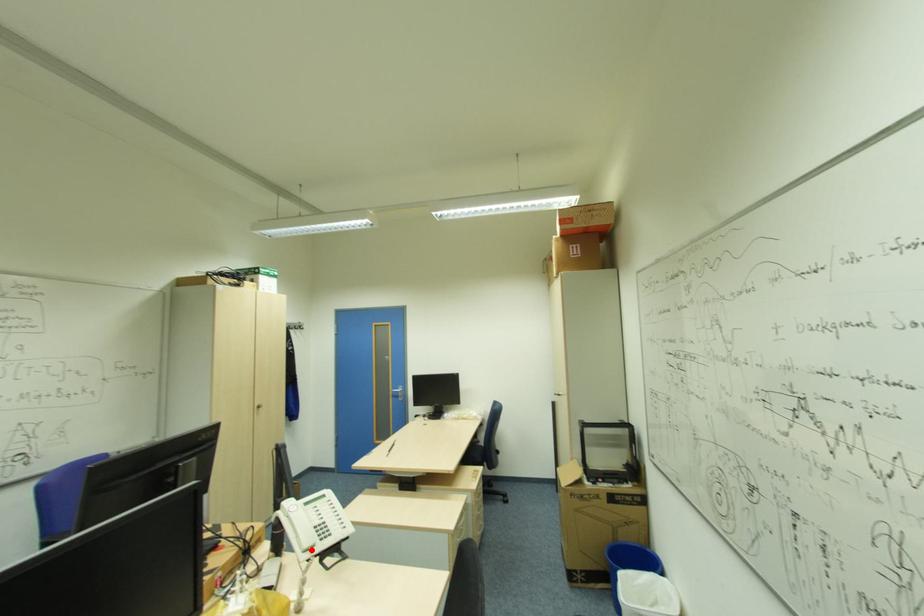
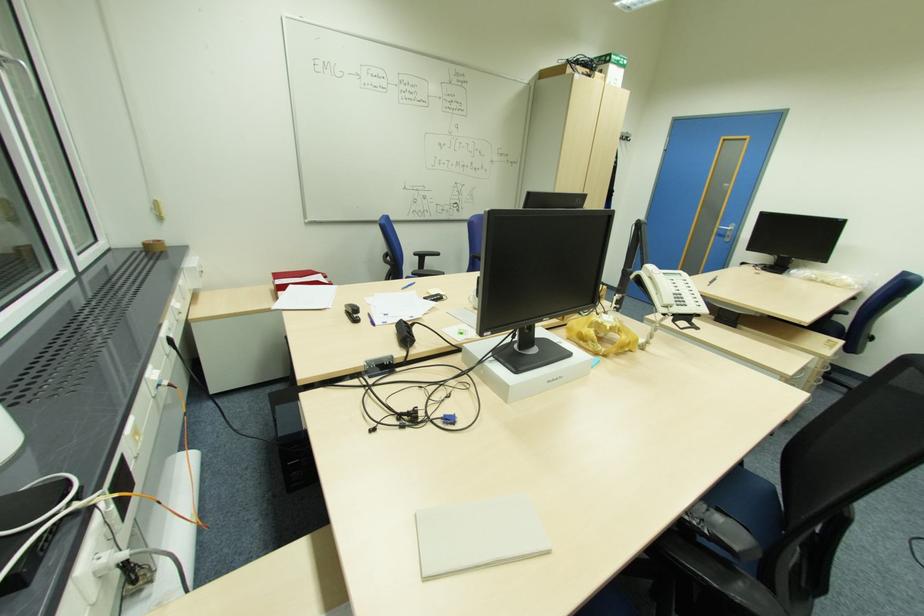
Question: I am providing you with two images of the same scene from different viewpoints. Image1 has a red point marked. In image2, the corresponding 3D location appears at what relative position? Reply with the corresponding letter.

Choices:
 (A) Closer
 (B) Farther

Answer: (A)